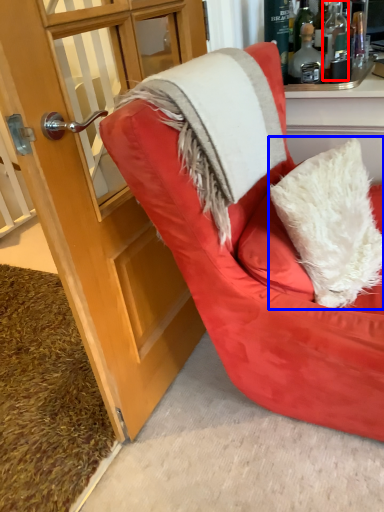
Question: Which object appears closest to the camera in this image, bottle (highlighted by a red box) or pillow (highlighted by a blue box)?

Choices:
 (A) bottle
 (B) pillow

Answer: (B)